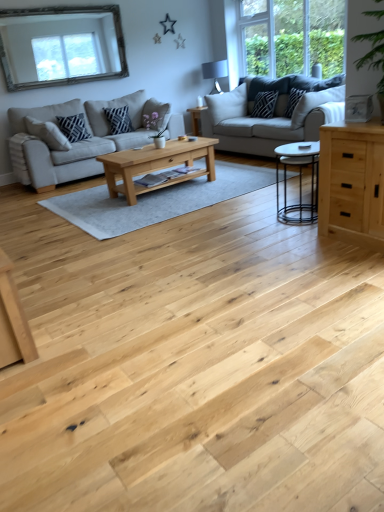
Locate an element on the screen. vacant region under black metal coffee table at center, the 1th coffee table in the right-to-left sequence (from a real-world perspective) is located at coordinates (296, 214).